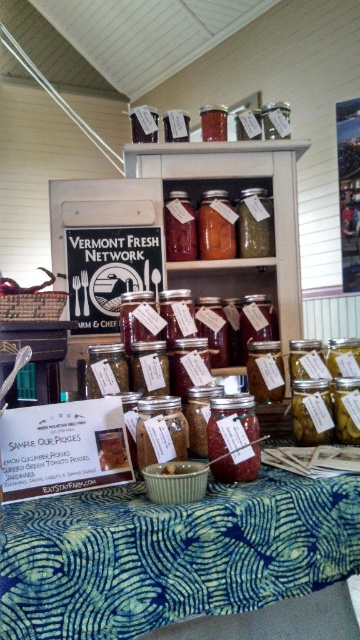
Question: Which point is closer to the camera?

Choices:
 (A) (249, 460)
 (B) (358, 481)

Answer: (B)

Question: Observing the image, what is the correct spatial positioning of blue printed fabric at lower center in reference to translucent glass jar at center?

Choices:
 (A) below
 (B) above

Answer: (A)

Question: Does blue printed fabric at lower center lie in front of translucent glass jar at center?

Choices:
 (A) no
 (B) yes

Answer: (B)

Question: Which object is closer to the camera taking this photo?

Choices:
 (A) translucent glass jar at center
 (B) blue printed fabric at lower center

Answer: (B)

Question: Is blue printed fabric at lower center smaller than translucent glass jar at center?

Choices:
 (A) no
 (B) yes

Answer: (A)